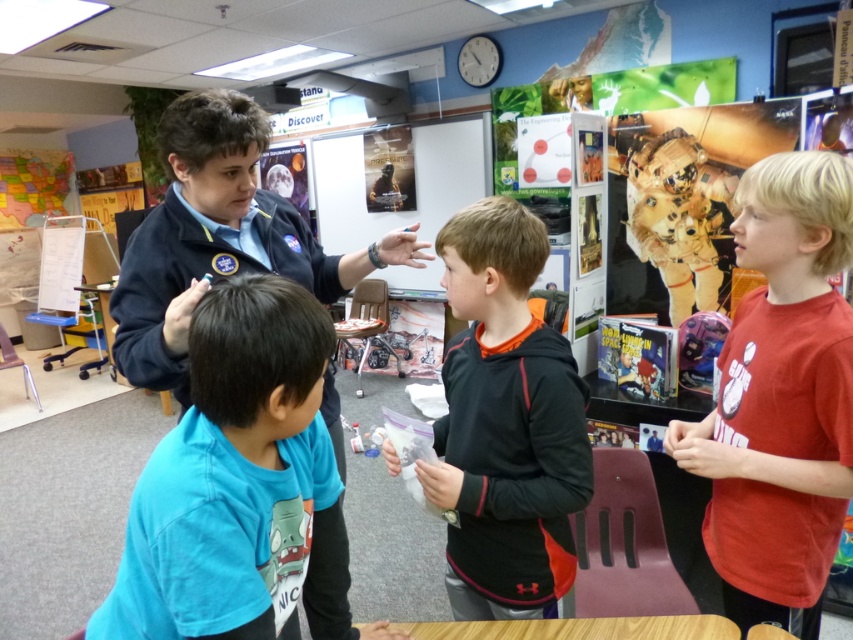
Does blue cotton shirt at center appear on the left side of brown fabric astronaut at upper right?

Indeed, blue cotton shirt at center is positioned on the left side of brown fabric astronaut at upper right.

Is blue cotton shirt at center smaller than brown fabric astronaut at upper right?

Actually, blue cotton shirt at center might be larger than brown fabric astronaut at upper right.

Find the location of a particular element. blue cotton shirt at center is located at coordinates (241, 484).

Is red cotton shirt at right positioned in front of brown fabric astronaut at upper right?

Yes.

Is red cotton shirt at right bigger than brown fabric astronaut at upper right?

Yes, red cotton shirt at right is bigger than brown fabric astronaut at upper right.

Is point (773, 195) closer to viewer compared to point (688, 257)?

Yes, point (773, 195) is closer to viewer.

Where is `red cotton shirt at right`? Image resolution: width=853 pixels, height=640 pixels. red cotton shirt at right is located at coordinates (780, 397).

Is red cotton shirt at right further to the viewer compared to black fleece hoodie at center?

No, it is not.

Does red cotton shirt at right appear over black fleece hoodie at center?

Correct, red cotton shirt at right is located above black fleece hoodie at center.

Which is behind, point (752, 374) or point (515, 387)?

Positioned behind is point (752, 374).

Find the location of a particular element. This screenshot has height=640, width=853. red cotton shirt at right is located at coordinates (780, 397).